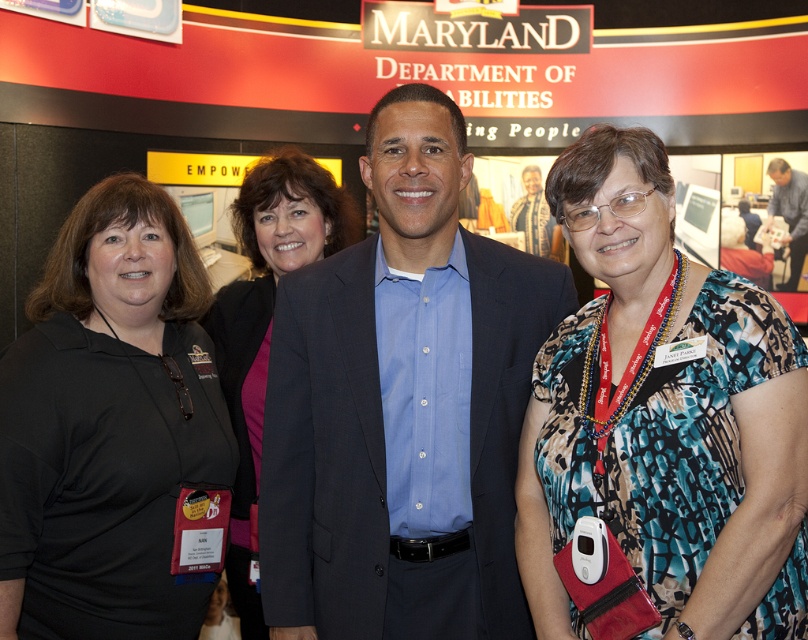
Question: Which object is farther from the camera taking this photo?

Choices:
 (A) printed fabric blouse at center
 (B) pink fabric shirt at center

Answer: (B)

Question: Can you confirm if blue cotton shirt at center is wider than black matte shirt at left?

Choices:
 (A) yes
 (B) no

Answer: (A)

Question: Which point appears closest to the camera in this image?

Choices:
 (A) (511, 220)
 (B) (591, 227)
 (C) (194, 372)

Answer: (B)

Question: Which of these objects is positioned farthest from the black matte shirt at left?

Choices:
 (A) blue cotton shirt at center
 (B) matte blue shirt at center
 (C) blue shirt at center
 (D) pink fabric shirt at center

Answer: (C)

Question: Is pink fabric shirt at center closer to camera compared to blue shirt at center?

Choices:
 (A) no
 (B) yes

Answer: (B)

Question: Is black matte shirt at left below matte blue shirt at center?

Choices:
 (A) no
 (B) yes

Answer: (B)